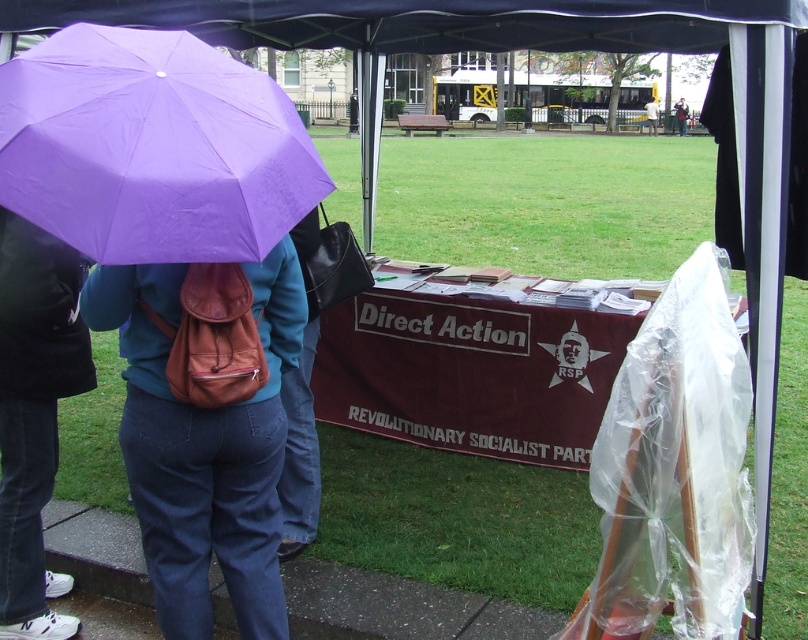
Question: Which point is closer to the camera taking this photo?

Choices:
 (A) (657, 116)
 (B) (684, 124)
 (C) (7, 252)

Answer: (C)

Question: Does brown leather backpack at left appear under light brown leather jacket at upper center?

Choices:
 (A) yes
 (B) no

Answer: (A)

Question: Which point is farther to the camera?

Choices:
 (A) (78, 272)
 (B) (133, 369)

Answer: (A)

Question: Is brown leather backpack at left above white plastic bag at center?

Choices:
 (A) no
 (B) yes

Answer: (A)

Question: Which of these objects is positioned farthest from the dark blue jeans at lower left?

Choices:
 (A) white plastic bag at center
 (B) purple matte umbrella at upper left

Answer: (A)

Question: Does dark blue jeans at lower left appear under light brown leather jacket at upper center?

Choices:
 (A) no
 (B) yes

Answer: (B)